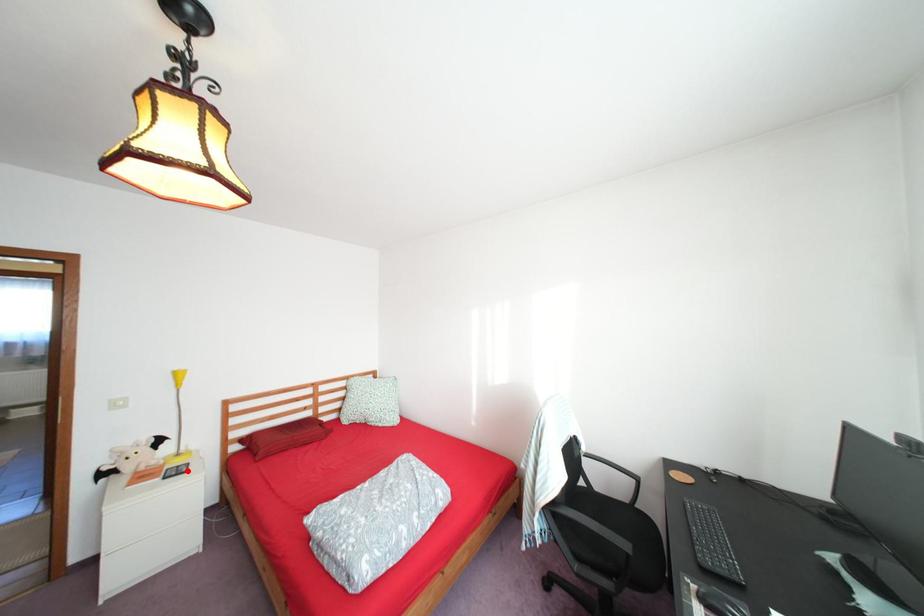
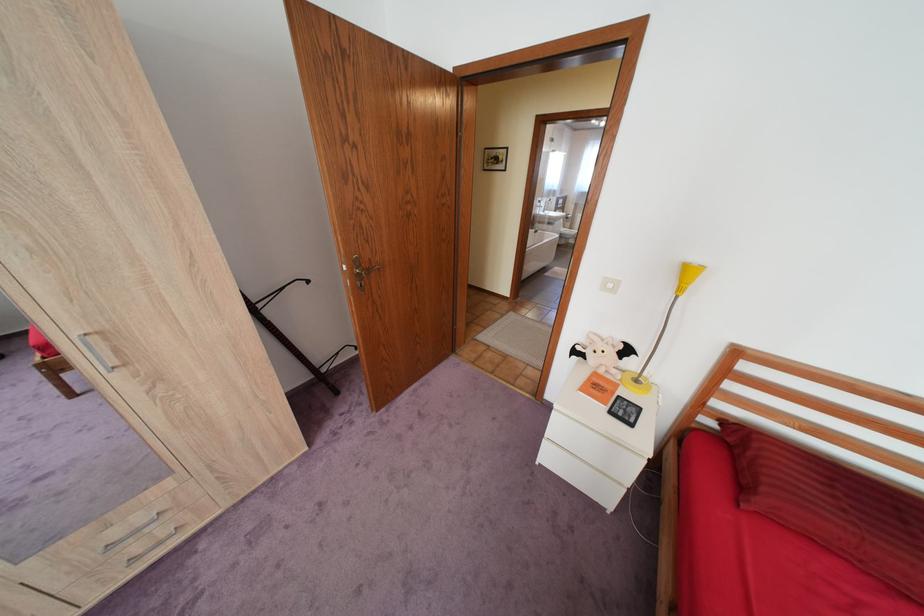
Where in the second image is the point corresponding to the highlighted location from the first image?

(636, 411)